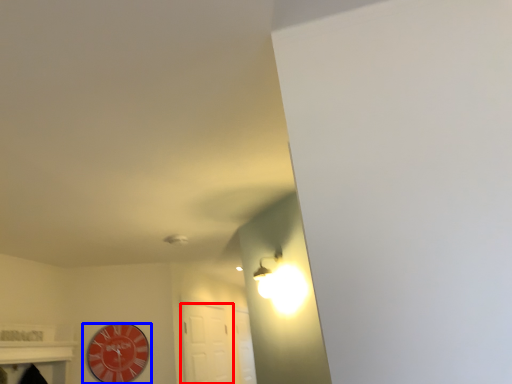
Question: Among these objects, which one is farthest to the camera, door (highlighted by a red box) or wall clock (highlighted by a blue box)?

Choices:
 (A) door
 (B) wall clock

Answer: (A)